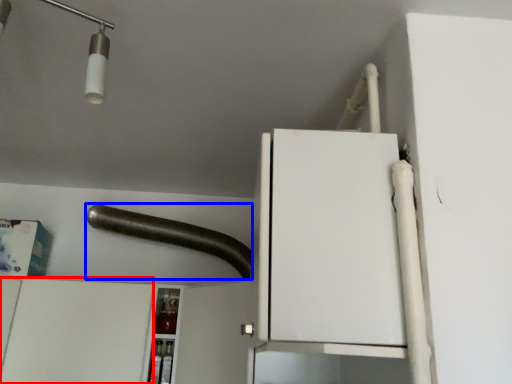
Question: Among these objects, which one is farthest to the camera, cabinetry (highlighted by a red box) or beam (highlighted by a blue box)?

Choices:
 (A) cabinetry
 (B) beam

Answer: (B)